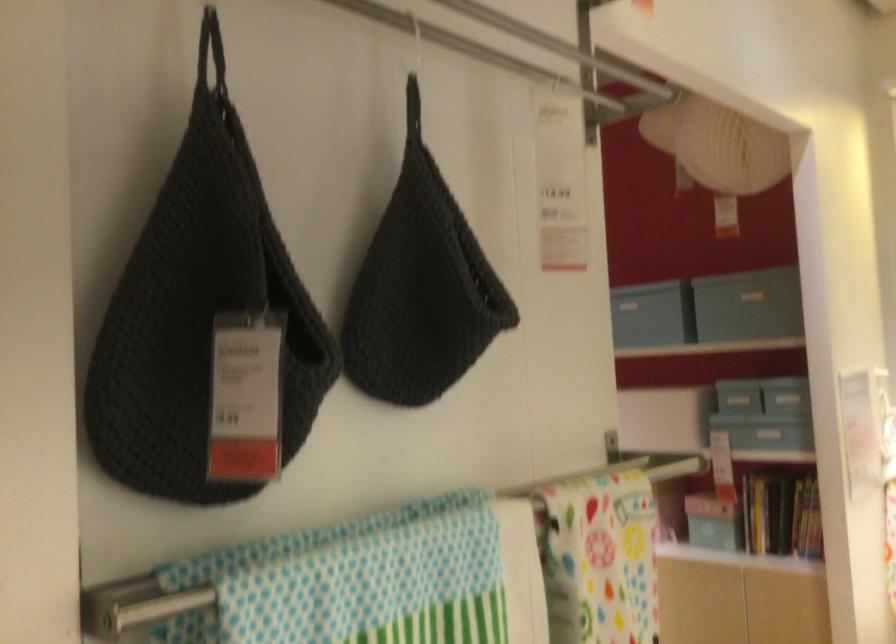
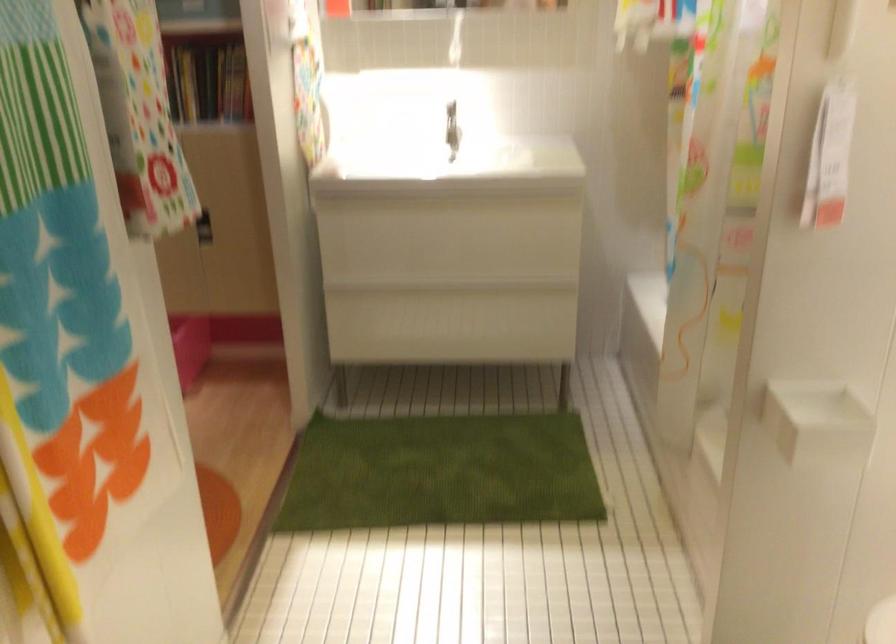
The images are taken continuously from a first-person perspective. In which direction is your viewpoint rotating?

The rotation direction of the camera is right-down.